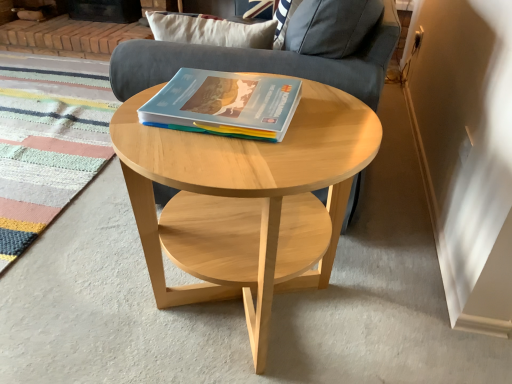
Question: Is matte plastic book at center in front of or behind multicolored woven mat at lower left in the image?

Choices:
 (A) front
 (B) behind

Answer: (A)

Question: Is matte plastic book at center inside the boundaries of multicolored woven mat at lower left, or outside?

Choices:
 (A) outside
 (B) inside

Answer: (A)

Question: Considering the real-world distances, which object is farthest from the matte plastic book at center?

Choices:
 (A) natural wood coffee table at center
 (B) multicolored woven mat at lower left
 (C) gray fabric armchair at center

Answer: (B)

Question: Which is nearer to the matte plastic book at center?

Choices:
 (A) multicolored woven mat at lower left
 (B) natural wood coffee table at center
 (C) gray fabric armchair at center

Answer: (B)